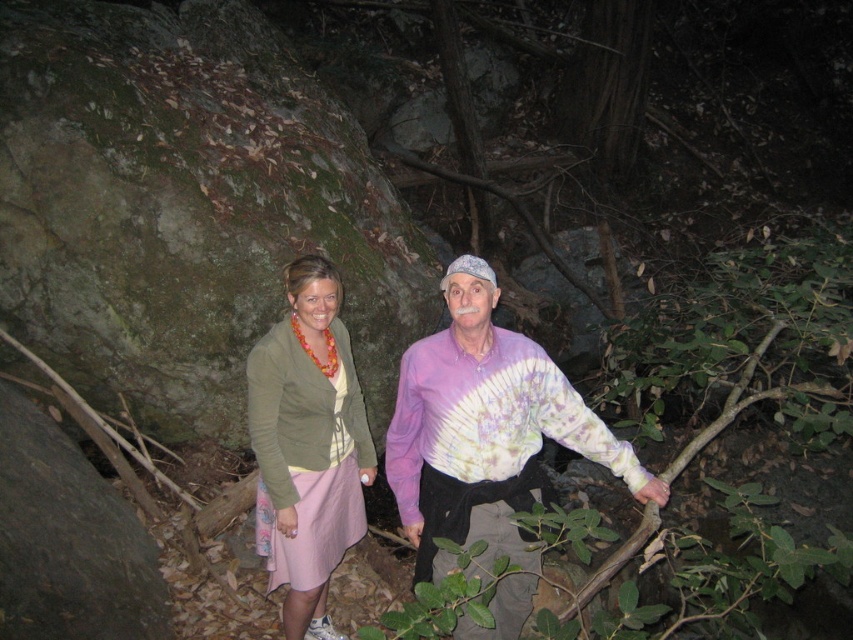
In the scene shown: You are standing in a dark forest at night. You see two points of light in the distance. One is at point (608, 465) and the other is at point (270, 515). According to the scene description, which point is closer to you?

Point (608, 465) is in front of point (270, 515), so it is closer to you.

You are standing in a dark forest and see a point marked at coordinates (486, 444). According to the image, what object is located at that point?

The point at coordinates (486, 444) indicates the tie dye fabric shirt at center.